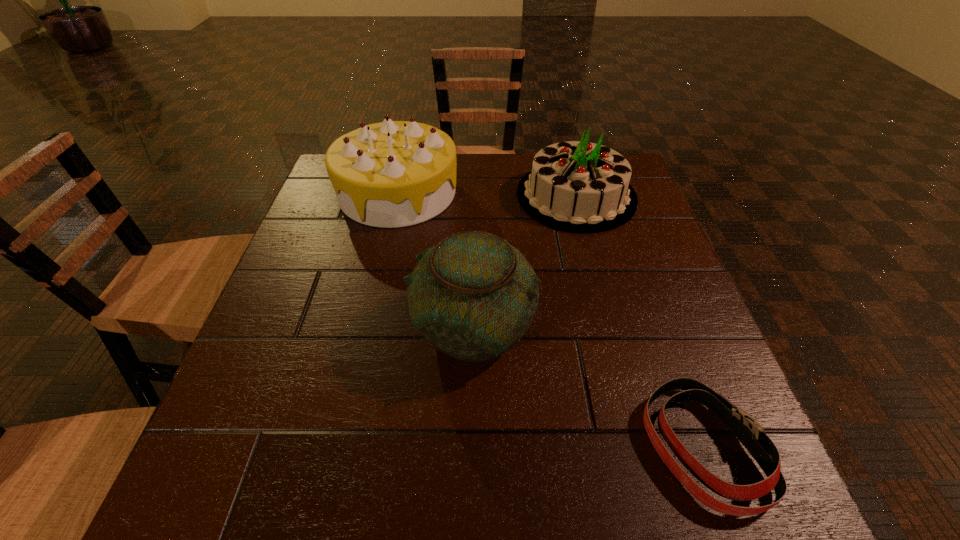
I want to click on the right birthday cake, so click(x=576, y=186).

Find the location of a particular element. Image resolution: width=960 pixels, height=540 pixels. the left birthday cake is located at coordinates (391, 174).

Where is `the second nearest object`? Image resolution: width=960 pixels, height=540 pixels. the second nearest object is located at coordinates (473, 296).

Locate an element on the screen. Image resolution: width=960 pixels, height=540 pixels. dog collar is located at coordinates (747, 430).

This screenshot has width=960, height=540. I want to click on the nearest object, so click(747, 430).

Identify the location of vacant space located 0.180m on the left of the right birthday cake. (448, 196).

I want to click on blank area located on the front of the left birthday cake, so click(356, 370).

In order to click on free space located on the back of the second nearest object in this screenshot , I will do `click(474, 224)`.

Find the location of a particular element. free space located 0.260m on the back of the nearest object is located at coordinates (641, 280).

Locate an element on the screen. object present at the near edge is located at coordinates (747, 430).